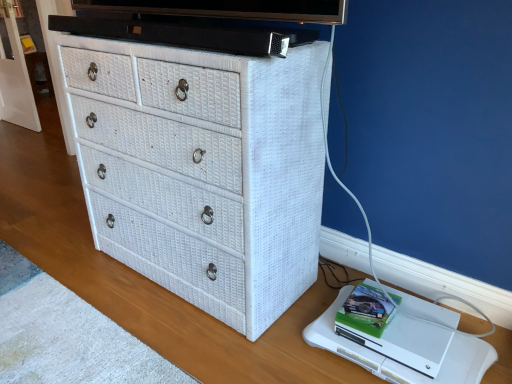
The height and width of the screenshot is (384, 512). Describe the element at coordinates (204, 171) in the screenshot. I see `white wicker chest of drawers at center` at that location.

At what (x,y) coordinates should I click in order to perform the action: click on white wicker chest of drawers at center. Please return your answer as a coordinate pair (x, y). Image resolution: width=512 pixels, height=384 pixels. Looking at the image, I should click on (204, 171).

Image resolution: width=512 pixels, height=384 pixels. What do you see at coordinates (403, 340) in the screenshot? I see `white matte xbox one at lower right` at bounding box center [403, 340].

I want to click on white matte xbox one at lower right, so click(x=403, y=340).

Locate an element on the screen. Image resolution: width=512 pixels, height=384 pixels. white wicker chest of drawers at center is located at coordinates (204, 171).

Between white matte xbox one at lower right and white wicker chest of drawers at center, which one appears on the right side from the viewer's perspective?

From the viewer's perspective, white matte xbox one at lower right appears more on the right side.

Which is behind, white matte xbox one at lower right or white wicker chest of drawers at center?

white matte xbox one at lower right is further from the camera.

Which is in front, point (407, 326) or point (288, 107)?

The point (288, 107) is closer.

From the image's perspective, is white matte xbox one at lower right below white wicker chest of drawers at center?

Correct, white matte xbox one at lower right appears lower than white wicker chest of drawers at center in the image.

From a real-world perspective, between white matte xbox one at lower right and white wicker chest of drawers at center, who is vertically lower?

white matte xbox one at lower right, from a real-world perspective.

Considering the relative sizes of white matte xbox one at lower right and white wicker chest of drawers at center in the image provided, is white matte xbox one at lower right thinner than white wicker chest of drawers at center?

Yes.

From their relative heights in the image, would you say white matte xbox one at lower right is taller or shorter than white wicker chest of drawers at center?

In the image, white matte xbox one at lower right appears to be shorter than white wicker chest of drawers at center.

Considering the sizes of objects white matte xbox one at lower right and white wicker chest of drawers at center in the image provided, who is bigger, white matte xbox one at lower right or white wicker chest of drawers at center?

white wicker chest of drawers at center is bigger.

Does white matte xbox one at lower right contain white wicker chest of drawers at center?

Definitely not — white wicker chest of drawers at center is not inside white matte xbox one at lower right.

Are white matte xbox one at lower right and white wicker chest of drawers at center beside each other?

No.

Is white matte xbox one at lower right facing away from white wicker chest of drawers at center?

white matte xbox one at lower right is not turned away from white wicker chest of drawers at center.

Can you tell me how much white matte xbox one at lower right and white wicker chest of drawers at center differ in facing direction?

The angular difference between white matte xbox one at lower right and white wicker chest of drawers at center is 3.04 degrees.

How far apart are white matte xbox one at lower right and white wicker chest of drawers at center?

The distance of white matte xbox one at lower right from white wicker chest of drawers at center is 22.41 inches.

Where is `the chest of drawers located above the white matte xbox one at lower right (from a real-world perspective)`? This screenshot has height=384, width=512. the chest of drawers located above the white matte xbox one at lower right (from a real-world perspective) is located at coordinates pos(204,171).

Is white wicker chest of drawers at center at the right side of white matte xbox one at lower right?

No.

Is white wicker chest of drawers at center in front of white matte xbox one at lower right?

Yes, it is in front of white matte xbox one at lower right.

Is point (79, 137) closer or farther from the camera than point (446, 332)?

Point (79, 137) is positioned farther from the camera compared to point (446, 332).

From the image's perspective, relative to white matte xbox one at lower right, is white wicker chest of drawers at center above or below?

Based on their image positions, white wicker chest of drawers at center is located above white matte xbox one at lower right.

From a real-world perspective, is white wicker chest of drawers at center positioned under white matte xbox one at lower right based on gravity?

No, from a real-world perspective, white wicker chest of drawers at center is not below white matte xbox one at lower right.

Considering the sizes of white wicker chest of drawers at center and white matte xbox one at lower right in the image, is white wicker chest of drawers at center wider or thinner than white matte xbox one at lower right?

In the image, white wicker chest of drawers at center appears to be wider than white matte xbox one at lower right.

Based on the photo, considering the sizes of objects white wicker chest of drawers at center and white matte xbox one at lower right in the image provided, who is shorter, white wicker chest of drawers at center or white matte xbox one at lower right?

white matte xbox one at lower right.

Who is bigger, white wicker chest of drawers at center or white matte xbox one at lower right?

white wicker chest of drawers at center is bigger.

Choose the correct answer: Is white wicker chest of drawers at center inside white matte xbox one at lower right or outside it?

white wicker chest of drawers at center is not inside white matte xbox one at lower right, it's outside.

Is white wicker chest of drawers at center not near white matte xbox one at lower right?

white wicker chest of drawers at center is actually quite close to white matte xbox one at lower right.

Is white wicker chest of drawers at center positioned with its back to white matte xbox one at lower right?

No, white wicker chest of drawers at center is not facing the opposite direction of white matte xbox one at lower right.

From the picture: How far apart are white wicker chest of drawers at center and white matte xbox one at lower right?

A distance of 22.41 inches exists between white wicker chest of drawers at center and white matte xbox one at lower right.

At what (x,y) coordinates should I click in order to perform the action: click on computer below the white wicker chest of drawers at center (from a real-world perspective). Please return your answer as a coordinate pair (x, y). Looking at the image, I should click on (403, 340).

The width and height of the screenshot is (512, 384). Identify the location of computer behind the white wicker chest of drawers at center. (403, 340).

Where is `computer on the right of white wicker chest of drawers at center`? computer on the right of white wicker chest of drawers at center is located at coordinates (403, 340).